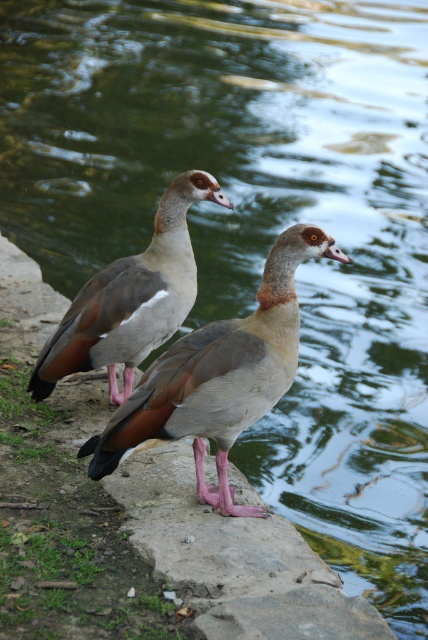
Question: Which point is closer to the camera taking this photo?

Choices:
 (A) (92, 355)
 (B) (196, 330)

Answer: (B)

Question: Which point appears closest to the camera in this image?

Choices:
 (A) (163, 364)
 (B) (202, 188)

Answer: (A)

Question: Can you confirm if brown matte goose at center is positioned above brown matte goose at upper left?

Choices:
 (A) no
 (B) yes

Answer: (A)

Question: Does brown matte goose at center have a greater width compared to brown matte goose at upper left?

Choices:
 (A) no
 (B) yes

Answer: (B)

Question: Observing the image, what is the correct spatial positioning of brown matte goose at center in reference to brown matte goose at upper left?

Choices:
 (A) above
 (B) below

Answer: (B)